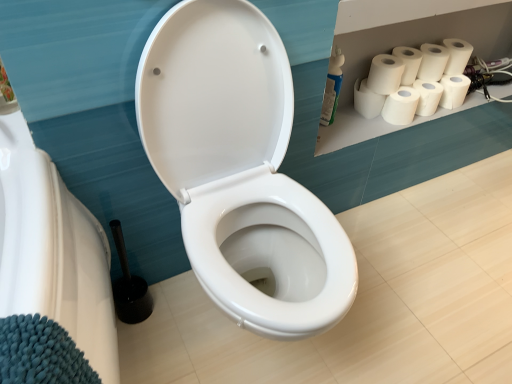
Question: Is white matte toilet paper at upper right, the first toilet paper when ordered from top to bottom, wider than white matte paper towel at upper right, marked as the fifth paper towel in a right-to-left arrangement?

Choices:
 (A) yes
 (B) no

Answer: (B)

Question: Can you confirm if white matte toilet paper at upper right, marked as the second toilet paper in a bottom-to-top arrangement, is smaller than white matte paper towel at upper right, which ranks as the second paper towel in left-to-right order?

Choices:
 (A) no
 (B) yes

Answer: (B)

Question: Can you confirm if white matte toilet paper at upper right, marked as the second toilet paper in a bottom-to-top arrangement, is positioned to the right of white matte paper towel at upper right, which ranks as the second paper towel in left-to-right order?

Choices:
 (A) no
 (B) yes

Answer: (B)

Question: From the image's perspective, does white matte toilet paper at upper right, the first toilet paper when ordered from top to bottom, appear lower than white matte paper towel at upper right, marked as the fifth paper towel in a right-to-left arrangement?

Choices:
 (A) no
 (B) yes

Answer: (A)

Question: Is white matte paper towel at upper right, marked as the fifth paper towel in a right-to-left arrangement, inside white matte toilet paper at upper right, the first toilet paper when ordered from top to bottom?

Choices:
 (A) yes
 (B) no

Answer: (B)

Question: Is white matte toilet paper at upper right, the first toilet paper when ordered from top to bottom, at the left side of white matte paper towel at upper right, which ranks as the second paper towel in left-to-right order?

Choices:
 (A) no
 (B) yes

Answer: (A)

Question: Considering the relative sizes of white matte toilet paper at upper right, marked as the second toilet paper in a bottom-to-top arrangement, and white glossy toilet at center in the image provided, is white matte toilet paper at upper right, marked as the second toilet paper in a bottom-to-top arrangement, smaller than white glossy toilet at center?

Choices:
 (A) no
 (B) yes

Answer: (B)

Question: Can you confirm if white matte toilet paper at upper right, marked as the second toilet paper in a bottom-to-top arrangement, is wider than white glossy toilet at center?

Choices:
 (A) no
 (B) yes

Answer: (A)

Question: Is white matte toilet paper at upper right, the first toilet paper when ordered from top to bottom, surrounding white glossy toilet at center?

Choices:
 (A) yes
 (B) no

Answer: (B)

Question: From the image's perspective, is white matte toilet paper at upper right, the first toilet paper when ordered from top to bottom, on top of white glossy toilet at center?

Choices:
 (A) yes
 (B) no

Answer: (A)

Question: Can you confirm if white matte toilet paper at upper right, marked as the second toilet paper in a bottom-to-top arrangement, is thinner than white glossy toilet at center?

Choices:
 (A) yes
 (B) no

Answer: (A)

Question: Does white matte toilet paper at upper right, the first toilet paper when ordered from top to bottom, have a larger size compared to white glossy toilet at center?

Choices:
 (A) no
 (B) yes

Answer: (A)

Question: Considering the relative positions of white matte paper towel at upper right, which appears as the sixth paper towel when viewed from the right, and white matte toilet paper at upper right, the first toilet paper when ordered from top to bottom, in the image provided, is white matte paper towel at upper right, which appears as the sixth paper towel when viewed from the right, in front of white matte toilet paper at upper right, the first toilet paper when ordered from top to bottom,?

Choices:
 (A) no
 (B) yes

Answer: (B)